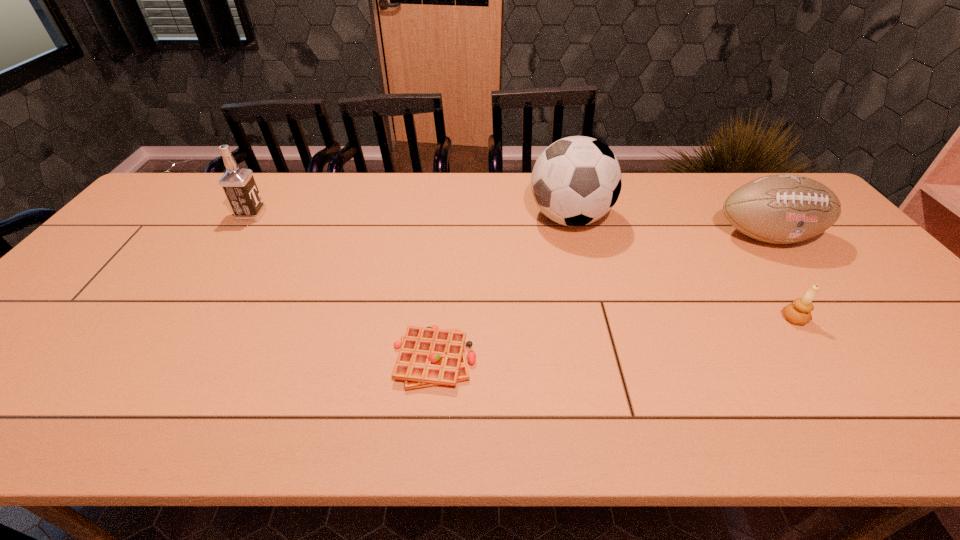
Choose which object is the third nearest neighbor to the soccer ball. Please provide its 2D coordinates. Your answer should be formatted as a tuple, i.e. [(x, y)], where the tuple contains the x and y coordinates of a point satisfying the conditions above.

[(799, 312)]

Locate an element on the screen. The width and height of the screenshot is (960, 540). vacant space that satisfies the following two spatial constraints: 1. on the back side of the second object from left to right; 2. on the front label of the vodka is located at coordinates (447, 215).

Locate an element on the screen. blank area in the image that satisfies the following two spatial constraints: 1. on the front label of the candle_holder; 2. on the right side of the leftmost object is located at coordinates (183, 319).

At what (x,y) coordinates should I click in order to perform the action: click on free space that satisfies the following two spatial constraints: 1. on the main logo of the fourth farthest object; 2. on the right side of the third object from right to left. Please return your answer as a coordinate pair (x, y). Looking at the image, I should click on (595, 319).

The height and width of the screenshot is (540, 960). What are the coordinates of `free location that satisfies the following two spatial constraints: 1. on the front label of the shortest object; 2. on the left side of the leftmost object` in the screenshot? It's located at (158, 358).